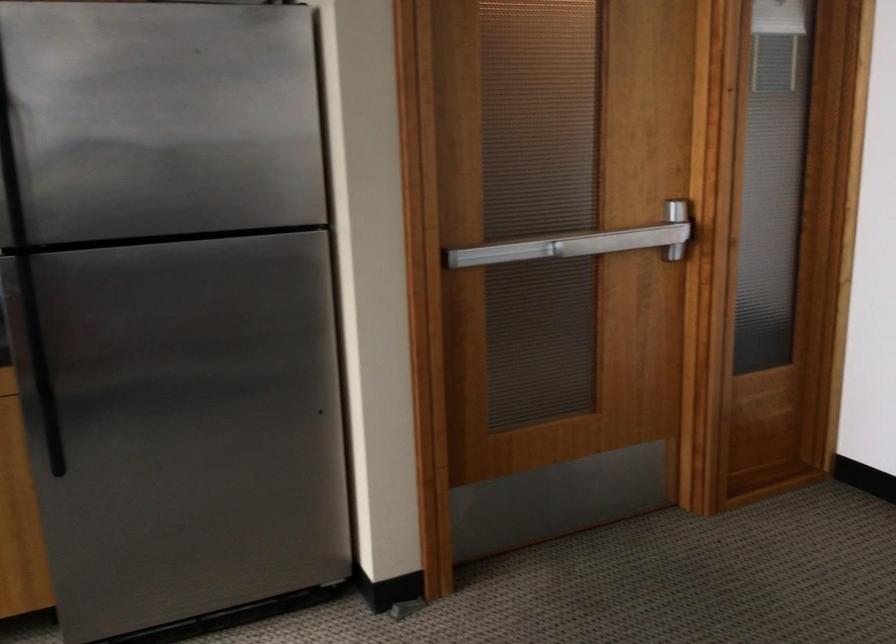
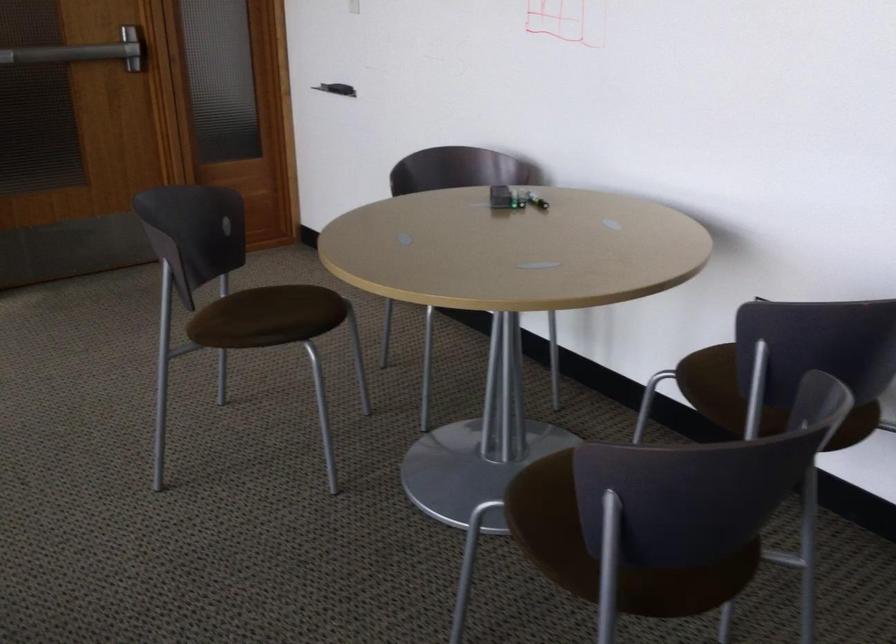
Which direction would the cameraman need to move to produce the second image?

The cameraman moved toward right, backward.